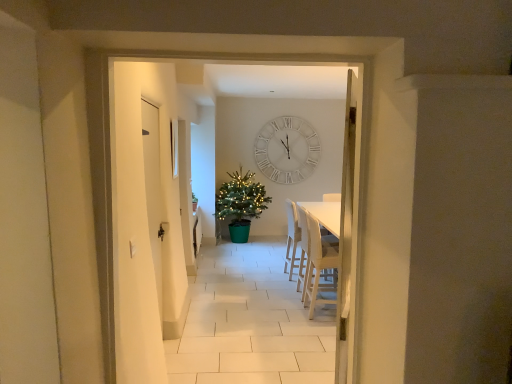
Identify the location of light beige fabric armchair at right, the 1th armchair positioned from the front. The image size is (512, 384). (319, 269).

Image resolution: width=512 pixels, height=384 pixels. What are the coordinates of `white matte wall clock at center` in the screenshot? It's located at (287, 150).

In order to click on light beige fabric armchair at right, the 1th armchair positioned from the front in this screenshot , I will do `click(319, 269)`.

Is light beige fabric armchair at right, the 1th armchair positioned from the front, thinner than white matte door at left?

No, light beige fabric armchair at right, the 1th armchair positioned from the front, is not thinner than white matte door at left.

This screenshot has width=512, height=384. I want to click on door on the left of light beige fabric armchair at right, the second armchair viewed from the back, so click(x=153, y=189).

Is light beige fabric armchair at right, the second armchair viewed from the back, with white matte door at left?

light beige fabric armchair at right, the second armchair viewed from the back, is not next to white matte door at left, and they're not touching.

Visually, is light beige fabric armchair at right, the 1th armchair positioned from the front, positioned to the left or to the right of white matte door at left?

In the image, light beige fabric armchair at right, the 1th armchair positioned from the front, appears on the right side of white matte door at left.

Between point (282, 176) and point (287, 253), which one is positioned in front?

The point (287, 253) is more forward.

I want to click on armchair that is the 1st one when counting forward from the white matte wall clock at center, so click(x=298, y=240).

Is white matte wall clock at center aimed at white fabric chair at center, placed as the 2th armchair when sorted from front to back?

Yes, white matte wall clock at center is oriented towards white fabric chair at center, placed as the 2th armchair when sorted from front to back.

From the image's perspective, is white matte wall clock at center on white fabric chair at center, which is counted as the first armchair, starting from the back?

Yes, from the image's perspective, white matte wall clock at center is above white fabric chair at center, which is counted as the first armchair, starting from the back.

Is white matte door at left facing away from white matte wall clock at center?

No, white matte door at left's orientation is not away from white matte wall clock at center.

From the image's perspective, relative to white matte wall clock at center, is white matte door at left above or below?

Based on their image positions, white matte door at left is located beneath white matte wall clock at center.

Looking at their sizes, would you say white matte door at left is wider or thinner than white matte wall clock at center?

Considering their sizes, white matte door at left looks broader than white matte wall clock at center.

Considering the points (154, 169) and (264, 128), which point is behind, point (154, 169) or point (264, 128)?

The point (264, 128) is behind.

Based on the photo, does green plastic christmas tree at center touch white fabric chair at center, which is counted as the first armchair, starting from the back?

green plastic christmas tree at center and white fabric chair at center, which is counted as the first armchair, starting from the back, are not in contact.

Is green plastic christmas tree at center to the left of white fabric chair at center, which is counted as the first armchair, starting from the back, from the viewer's perspective?

Indeed, green plastic christmas tree at center is positioned on the left side of white fabric chair at center, which is counted as the first armchair, starting from the back.

Is green plastic christmas tree at center facing towards white fabric chair at center, which is counted as the first armchair, starting from the back?

Yes, green plastic christmas tree at center faces towards white fabric chair at center, which is counted as the first armchair, starting from the back.

From a real-world perspective, is white fabric chair at center, which is counted as the first armchair, starting from the back, located higher than light beige fabric armchair at right, the 1th armchair positioned from the front?

Actually, white fabric chair at center, which is counted as the first armchair, starting from the back, is physically below light beige fabric armchair at right, the 1th armchair positioned from the front, in the real world.

Locate an element on the screen. armchair behind the light beige fabric armchair at right, the 1th armchair positioned from the front is located at coordinates (298, 240).

From the image's perspective, is white fabric chair at center, which is counted as the first armchair, starting from the back, positioned above or below light beige fabric armchair at right, the second armchair viewed from the back?

white fabric chair at center, which is counted as the first armchair, starting from the back, is situated higher than light beige fabric armchair at right, the second armchair viewed from the back, in the image.

How distant is white fabric chair at center, placed as the 2th armchair when sorted from front to back, from green plastic christmas tree at center?

white fabric chair at center, placed as the 2th armchair when sorted from front to back, and green plastic christmas tree at center are 5.90 feet apart from each other.

What's the angular difference between white fabric chair at center, placed as the 2th armchair when sorted from front to back, and green plastic christmas tree at center's facing directions?

The facing directions of white fabric chair at center, placed as the 2th armchair when sorted from front to back, and green plastic christmas tree at center are 94.1 degrees apart.

From a real-world perspective, which object stands above the other?

green plastic christmas tree at center.

Considering the relative sizes of white fabric chair at center, which is counted as the first armchair, starting from the back, and green plastic christmas tree at center in the image provided, is white fabric chair at center, which is counted as the first armchair, starting from the back, taller than green plastic christmas tree at center?

No.

In the scene shown: Considering the sizes of white matte door at left and white fabric chair at center, which is counted as the first armchair, starting from the back, in the image, is white matte door at left taller or shorter than white fabric chair at center, which is counted as the first armchair, starting from the back,?

Considering their sizes, white matte door at left has more height than white fabric chair at center, which is counted as the first armchair, starting from the back.

Could you tell me if white matte door at left is turned towards white fabric chair at center, placed as the 2th armchair when sorted from front to back?

No, white matte door at left does not turn towards white fabric chair at center, placed as the 2th armchair when sorted from front to back.

Can you confirm if white matte door at left is smaller than white fabric chair at center, which is counted as the first armchair, starting from the back?

Yes, white matte door at left is smaller than white fabric chair at center, which is counted as the first armchair, starting from the back.

At what (x,y) coordinates should I click in order to perform the action: click on door that is above the light beige fabric armchair at right, the 1th armchair positioned from the front (from a real-world perspective). Please return your answer as a coordinate pair (x, y). Image resolution: width=512 pixels, height=384 pixels. Looking at the image, I should click on (153, 189).

Starting from the white matte wall clock at center, which armchair is the 1st one to the right? Please provide its 2D coordinates.

[(298, 240)]

When comparing their distances from white matte door at left, does white matte wall clock at center or green plastic christmas tree at center seem closer?

green plastic christmas tree at center lies closer to white matte door at left than the other object.

When comparing their distances from white matte door at left, does white fabric chair at center, placed as the 2th armchair when sorted from front to back, or light beige fabric armchair at right, the second armchair viewed from the back, seem closer?

light beige fabric armchair at right, the second armchair viewed from the back, is closer to white matte door at left.

Estimate the real-world distances between objects in this image. Which object is further from light beige fabric armchair at right, the 1th armchair positioned from the front, white fabric chair at center, which is counted as the first armchair, starting from the back, or green plastic christmas tree at center?

The object further to light beige fabric armchair at right, the 1th armchair positioned from the front, is green plastic christmas tree at center.

Considering their positions, is white matte wall clock at center positioned further to green plastic christmas tree at center than light beige fabric armchair at right, the 1th armchair positioned from the front?

light beige fabric armchair at right, the 1th armchair positioned from the front.

Which object lies further to the anchor point green plastic christmas tree at center, white matte wall clock at center or white matte door at left?

Based on the image, white matte door at left appears to be further to green plastic christmas tree at center.

Estimate the real-world distances between objects in this image. Which object is further from white matte door at left, green plastic christmas tree at center or light beige fabric armchair at right, the 1th armchair positioned from the front?

green plastic christmas tree at center lies further to white matte door at left than the other object.

Which object lies nearer to the anchor point green plastic christmas tree at center, white fabric chair at center, placed as the 2th armchair when sorted from front to back, or light beige fabric armchair at right, the second armchair viewed from the back?

Among the two, white fabric chair at center, placed as the 2th armchair when sorted from front to back, is located nearer to green plastic christmas tree at center.

Looking at the image, which one is located closer to green plastic christmas tree at center, light beige fabric armchair at right, the second armchair viewed from the back, or white matte wall clock at center?

white matte wall clock at center.

In order to click on armchair located between light beige fabric armchair at right, the second armchair viewed from the back, and white matte wall clock at center in the depth direction in this screenshot , I will do `click(298, 240)`.

This screenshot has width=512, height=384. Find the location of `christmas tree positioned between white matte door at left and white matte wall clock at center from near to far`. christmas tree positioned between white matte door at left and white matte wall clock at center from near to far is located at coordinates (241, 198).

The width and height of the screenshot is (512, 384). I want to click on armchair positioned between white matte door at left and white fabric chair at center, placed as the 2th armchair when sorted from front to back, from near to far, so (x=319, y=269).

At what (x,y) coordinates should I click in order to perform the action: click on armchair between light beige fabric armchair at right, the second armchair viewed from the back, and green plastic christmas tree at center from front to back. Please return your answer as a coordinate pair (x, y). This screenshot has width=512, height=384. Looking at the image, I should click on (298, 240).